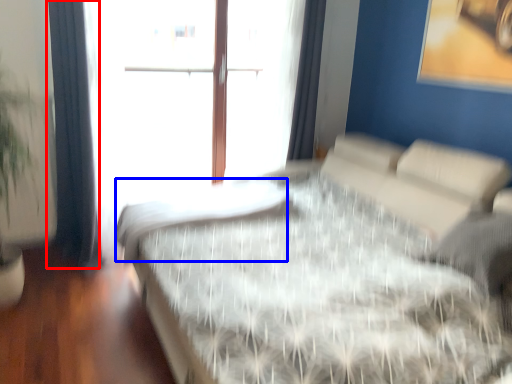
Question: Which point is further to the camera, curtain (highlighted by a red box) or mattress (highlighted by a blue box)?

Choices:
 (A) curtain
 (B) mattress

Answer: (A)